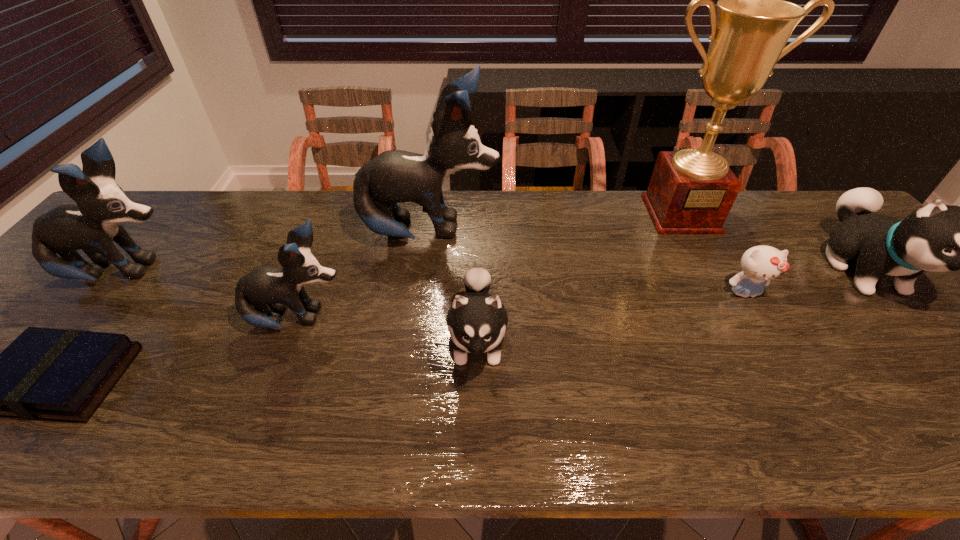
Image resolution: width=960 pixels, height=540 pixels. Identify the location of object that is at the right edge. (938, 238).

Locate an element on the screen. This screenshot has height=540, width=960. object that is positioned at the far right corner is located at coordinates (938, 238).

Locate an element on the screen. This screenshot has width=960, height=540. free location at the far edge is located at coordinates (470, 232).

This screenshot has width=960, height=540. In the image, there is a desktop. In order to click on free space at the near edge in this screenshot , I will do `click(731, 435)`.

Find the location of a particular element. This screenshot has height=540, width=960. vacant space at the left edge of the desktop is located at coordinates (93, 298).

This screenshot has height=540, width=960. What are the coordinates of `vacant space at the right edge of the desktop` in the screenshot? It's located at point(911,305).

Locate an element on the screen. The image size is (960, 540). free spot between the nearest black puppy and the second tallest object is located at coordinates (364, 276).

Find the location of a particular element. This screenshot has height=540, width=960. vacant space that's between the bigger white puppy and the tallest object is located at coordinates (772, 242).

Identify the location of free spot between the smallest black puppy and the rightmost object. (581, 295).

In order to click on free area in between the tallest puppy and the trophy cup in this screenshot , I will do `click(556, 224)`.